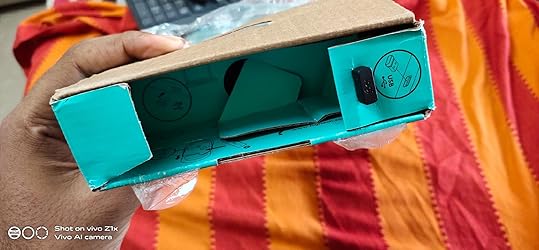
Find the location of `blanket`. blanket is located at coordinates (490, 164).